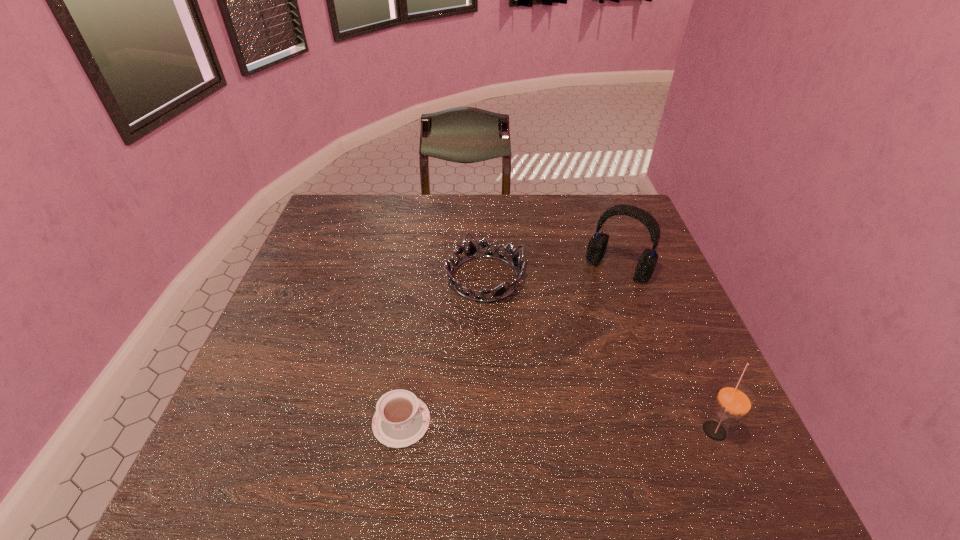
Where is `blank space at the near edge of the desktop`? blank space at the near edge of the desktop is located at coordinates (433, 421).

The image size is (960, 540). In order to click on vacant space at the left edge in this screenshot , I will do `click(304, 312)`.

In the image, there is a desktop. Where is `vacant space at the right edge`? This screenshot has height=540, width=960. vacant space at the right edge is located at coordinates (643, 249).

What are the coordinates of `vacant region at the far left corner of the desktop` in the screenshot? It's located at (342, 220).

Identify the location of vacant point at the far right corner. The height and width of the screenshot is (540, 960). (591, 201).

Locate an element on the screen. Image resolution: width=960 pixels, height=540 pixels. free point between the tiara and the headset is located at coordinates (551, 273).

Where is `unoccupied area between the leftmost object and the second object from left to right`? unoccupied area between the leftmost object and the second object from left to right is located at coordinates (444, 350).

Locate an element on the screen. Image resolution: width=960 pixels, height=540 pixels. free space between the second shortest object and the straw is located at coordinates (599, 354).

Where is `vacant space that's between the third tallest object and the straw`? The image size is (960, 540). vacant space that's between the third tallest object and the straw is located at coordinates (599, 354).

This screenshot has width=960, height=540. Identify the location of vacant space that is in between the third object from right to left and the headset. (551, 273).